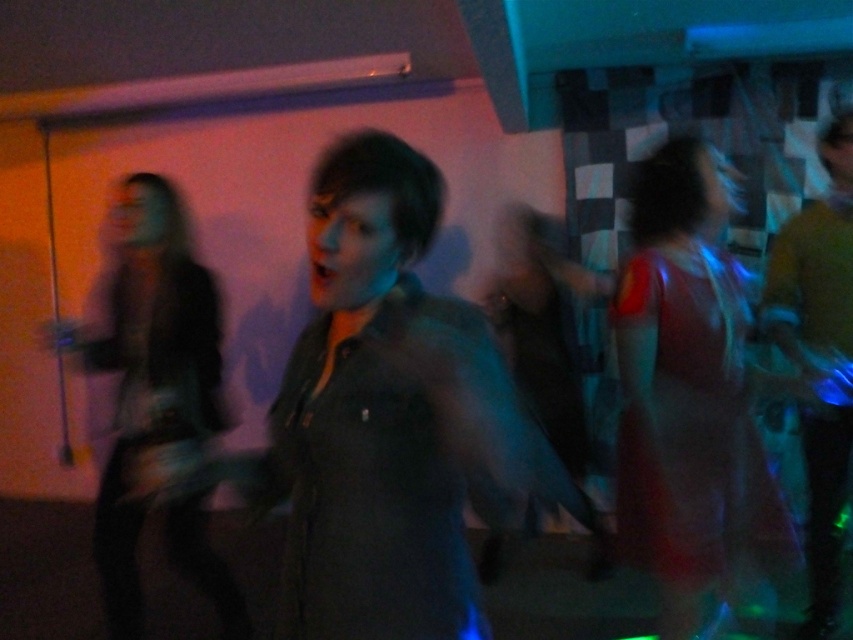
What do you see at coordinates (395, 420) in the screenshot?
I see `dark gray shirt at center` at bounding box center [395, 420].

Does point (341, 358) come behind point (212, 576)?

No.

Does point (434, 637) come in front of point (131, 344)?

Yes.

I want to click on dark gray shirt at center, so [395, 420].

Based on the photo, does dark gray shirt at center have a greater width compared to shiny red dress at right?

Yes, dark gray shirt at center is wider than shiny red dress at right.

Is dark gray shirt at center bigger than shiny red dress at right?

Yes, dark gray shirt at center is bigger than shiny red dress at right.

Between point (442, 198) and point (712, 179), which one is positioned behind?

Positioned behind is point (712, 179).

Where is `dark gray shirt at center`? dark gray shirt at center is located at coordinates (395, 420).

Is shiny red dress at right bigger than dark gray fabric jacket at left?

Actually, shiny red dress at right might be smaller than dark gray fabric jacket at left.

Image resolution: width=853 pixels, height=640 pixels. What do you see at coordinates (689, 397) in the screenshot? I see `shiny red dress at right` at bounding box center [689, 397].

Where is `shiny red dress at right`? The image size is (853, 640). shiny red dress at right is located at coordinates [689, 397].